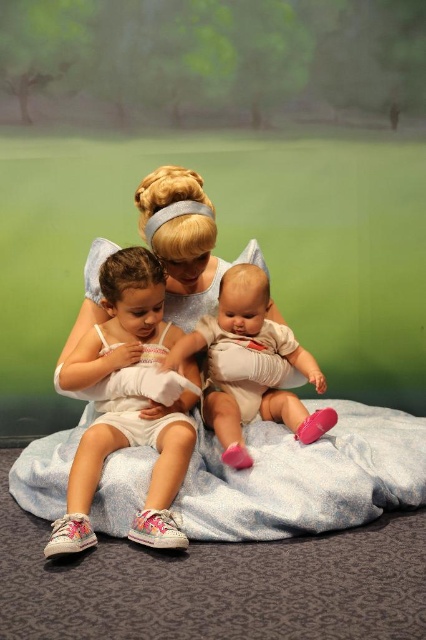
You are a photographer setting up a photo shoot for a Tinkerbell themed event. You have a white soft blanket at center and a white fabric dress at center in the scene. Since you want to ensure proper framing, which object should you place closer to the camera to emphasize its larger size?

The white soft blanket at center should be placed closer to the camera because its width surpasses that of the white fabric dress at center, making it naturally larger and more visually impactful when emphasized.

Consider the image. You are a photographer setting up for a family photo. You see a white soft blanket at center and a white cotton baby at center. Which object is directly underneath the other?

The white soft blanket at center is positioned under the white cotton baby at center.